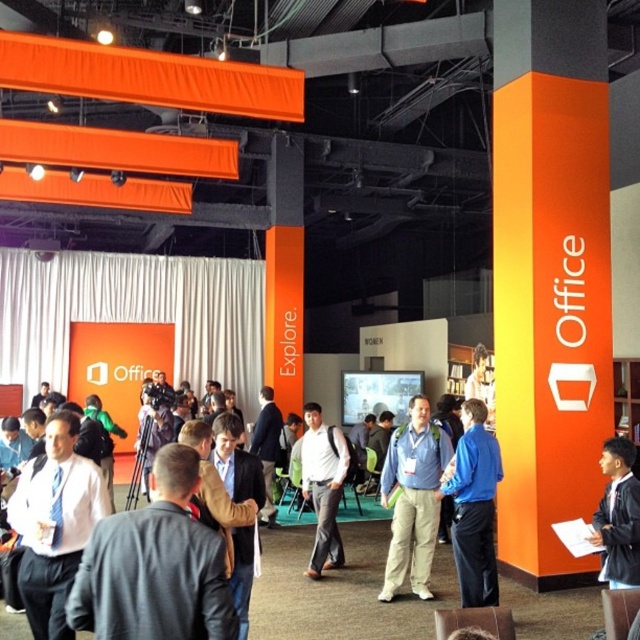
In the scene shown: Can you confirm if blue fabric backpack at center is positioned below dark blue suit at lower right?

Yes, blue fabric backpack at center is below dark blue suit at lower right.

Does blue fabric backpack at center have a smaller size compared to dark blue suit at lower right?

Actually, blue fabric backpack at center might be larger than dark blue suit at lower right.

The height and width of the screenshot is (640, 640). What are the coordinates of `blue fabric backpack at center` in the screenshot? It's located at (413, 499).

Locate an element on the screen. This screenshot has height=640, width=640. blue fabric backpack at center is located at coordinates (413, 499).

Is matte blue tie at center taller than white matte shirt at center?

No, matte blue tie at center is not taller than white matte shirt at center.

Is point (29, 540) closer to camera compared to point (301, 481)?

Yes, point (29, 540) is in front of point (301, 481).

Where is `matte blue tie at center`? matte blue tie at center is located at coordinates (54, 524).

From the picture: Who is more distant from viewer, (154, 516) or (611, 502)?

The point (611, 502) is more distant.

Can you confirm if gray fabric jacket at center is thinner than dark blue suit at lower right?

No.

Locate an element on the screen. gray fabric jacket at center is located at coordinates (156, 566).

This screenshot has width=640, height=640. Identify the location of gray fabric jacket at center. (156, 566).